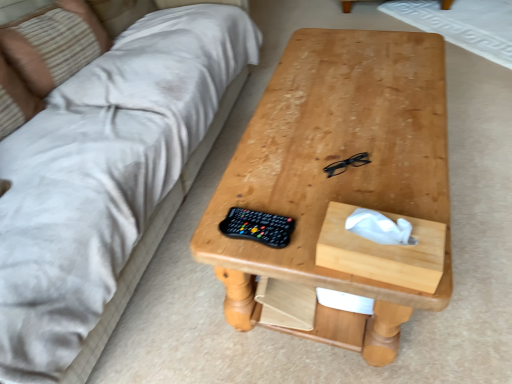
Question: Is beige striped pillow at upper left to the left of black plastic glasses at center from the viewer's perspective?

Choices:
 (A) yes
 (B) no

Answer: (A)

Question: Can you confirm if beige striped pillow at upper left is wider than black plastic glasses at center?

Choices:
 (A) no
 (B) yes

Answer: (B)

Question: From a real-world perspective, is beige striped pillow at upper left positioned over black plastic glasses at center based on gravity?

Choices:
 (A) yes
 (B) no

Answer: (A)

Question: Is beige striped pillow at upper left outside of black plastic glasses at center?

Choices:
 (A) no
 (B) yes

Answer: (B)

Question: Does beige striped pillow at upper left have a larger size compared to black plastic glasses at center?

Choices:
 (A) no
 (B) yes

Answer: (B)

Question: Does point (159, 144) appear closer or farther from the camera than point (51, 18)?

Choices:
 (A) farther
 (B) closer

Answer: (B)

Question: Relative to beige striped pillow at upper left, is beige fabric couch at upper left in front or behind?

Choices:
 (A) behind
 (B) front

Answer: (B)

Question: Looking at their shapes, would you say beige fabric couch at upper left is wider or thinner than beige striped pillow at upper left?

Choices:
 (A) wide
 (B) thin

Answer: (A)

Question: From a real-world perspective, relative to beige striped pillow at upper left, is beige fabric couch at upper left vertically above or below?

Choices:
 (A) above
 (B) below

Answer: (B)

Question: In the image, is wooden tissue box at center-right on the left side or the right side of beige striped pillow at upper left?

Choices:
 (A) right
 (B) left

Answer: (A)

Question: Based on their sizes in the image, would you say wooden tissue box at center-right is bigger or smaller than beige striped pillow at upper left?

Choices:
 (A) big
 (B) small

Answer: (B)

Question: From a real-world perspective, is wooden tissue box at center-right above or below beige striped pillow at upper left?

Choices:
 (A) below
 (B) above

Answer: (A)

Question: From the image's perspective, relative to beige striped pillow at upper left, is wooden tissue box at center-right above or below?

Choices:
 (A) above
 (B) below

Answer: (B)

Question: Considering the positions of wooden tissue box at center-right and natural wood table at center in the image, is wooden tissue box at center-right wider or thinner than natural wood table at center?

Choices:
 (A) thin
 (B) wide

Answer: (A)

Question: In the image, is wooden tissue box at center-right positioned in front of or behind natural wood table at center?

Choices:
 (A) front
 (B) behind

Answer: (A)